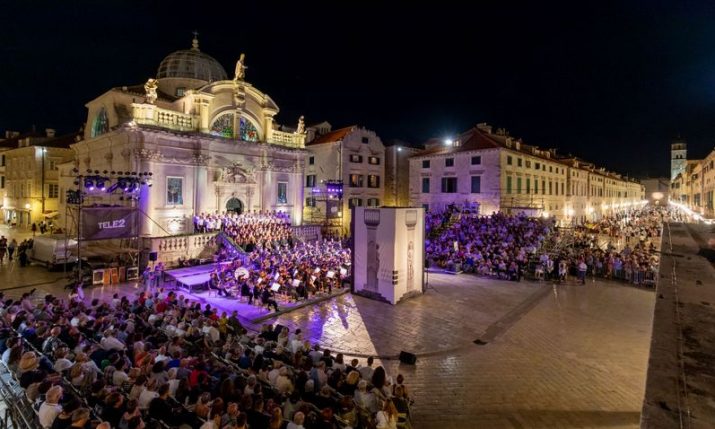
Locate an element on the screen. The height and width of the screenshot is (429, 715). purple light area is located at coordinates (235, 305), (209, 297), (194, 278), (207, 269), (317, 326).